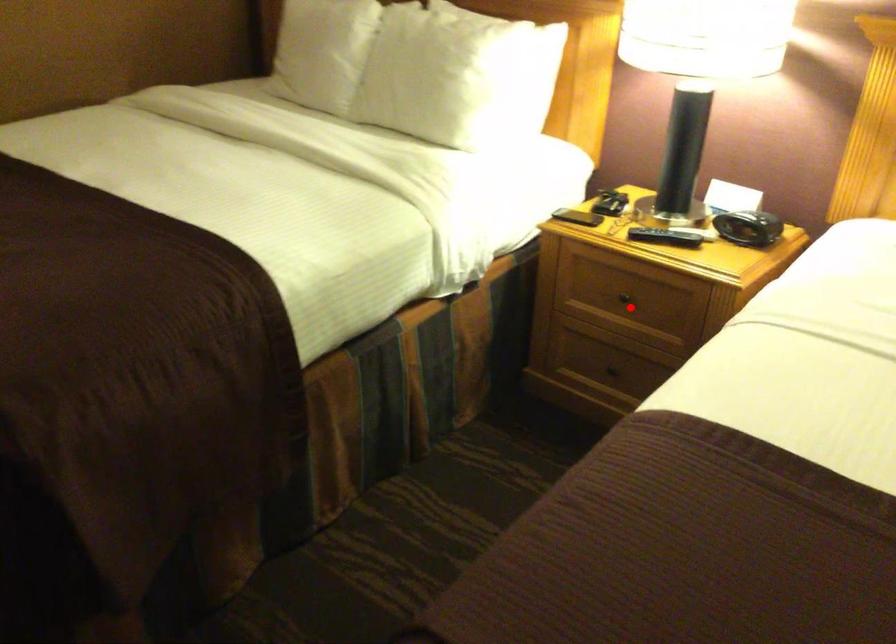
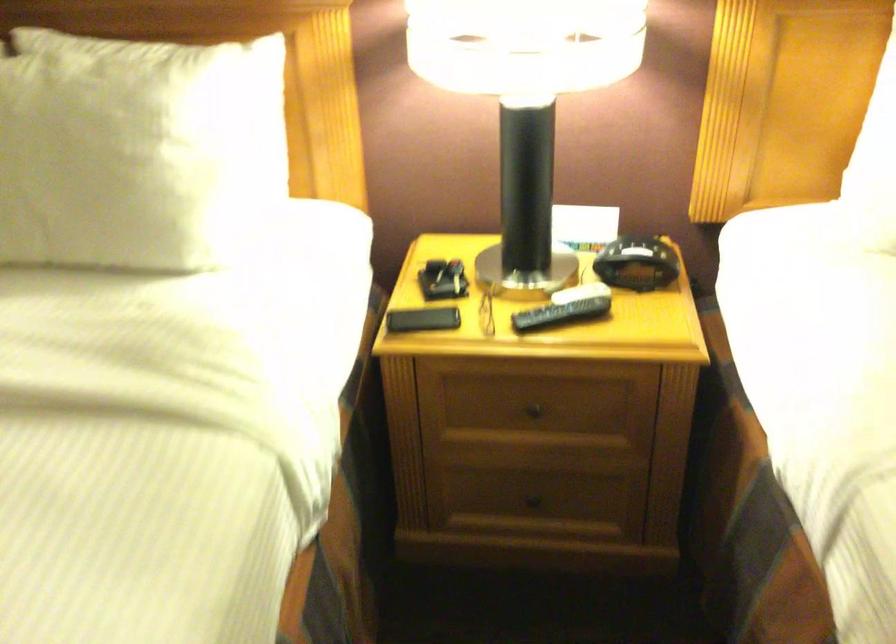
Find the pixel in the second image that matches the highlighted location in the first image.

(540, 413)